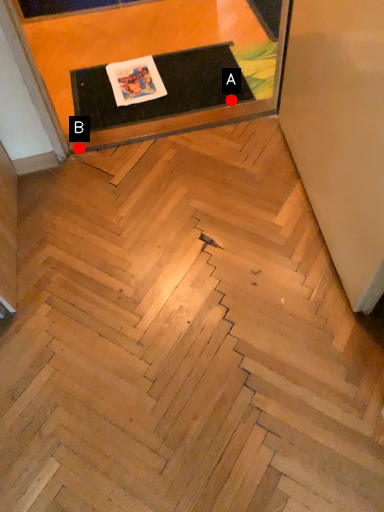
Question: Two points are circled on the image, labeled by A and B beside each circle. Which point appears closest to the camera in this image?

Choices:
 (A) A is closer
 (B) B is closer

Answer: (B)